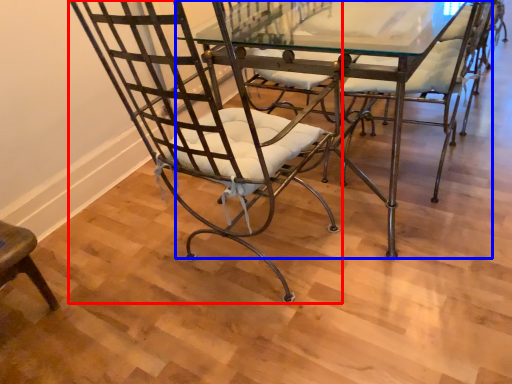
Question: Which of the following is the closest to the observer, chair (highlighted by a red box) or table (highlighted by a blue box)?

Choices:
 (A) chair
 (B) table

Answer: (A)